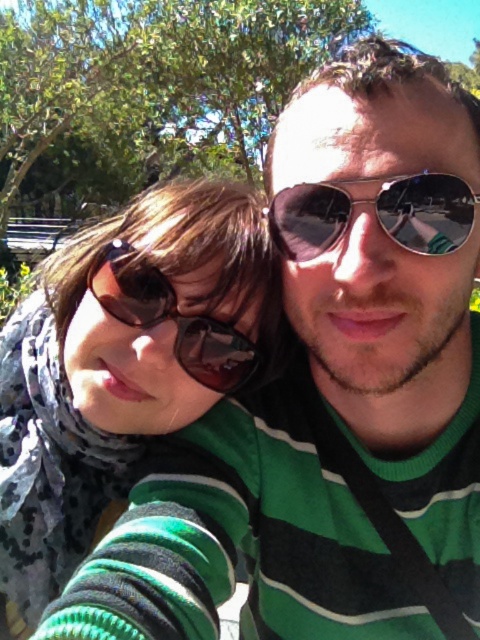
You are trying to decide which pair of sunglasses to buy based on size. You prefer a smaller pair. Looking at the metallic aviator sunglasses at center and the brown reflective sunglasses at left in the image, which one should you choose?

The metallic aviator sunglasses at center is smaller than the brown reflective sunglasses at left, so you should choose the metallic aviator sunglasses at center.

You are trying to decide which pair of sunglasses to buy. You want the wider one. Which one should you choose between the matte black sunglasses at upper left and the metallic aviator sunglasses at center?

The matte black sunglasses at upper left is wider than the metallic aviator sunglasses at center, so you should choose the matte black sunglasses at upper left.

In the scene shown: You are holding a camera and want to take a selfie with the metallic aviator sunglasses at center. If your hand is 12 inches away from the camera, can you fit the sunglasses into the frame without moving your hand?

The metallic aviator sunglasses at center are 29.23 inches away from the camera. Since your hand is only 12 inches away, the sunglasses are further away than your hand, so they will be in the frame as long as your hand doesn not block them.